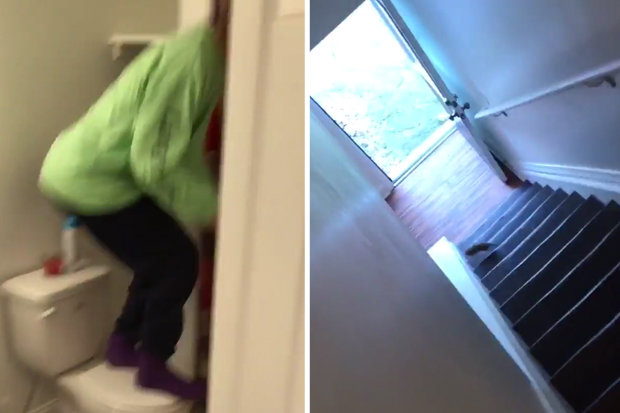
Image resolution: width=620 pixels, height=413 pixels. What are the coordinates of `doorway` in the screenshot? It's located at (407, 116).